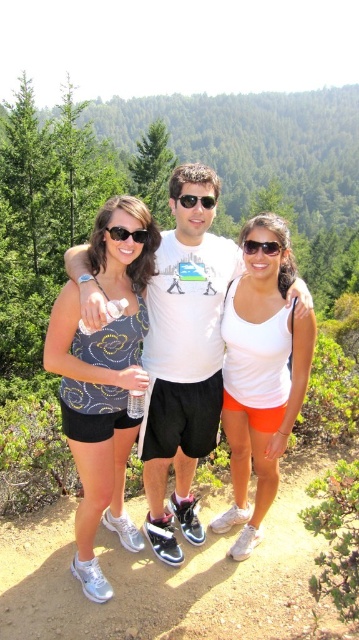
From the picture: You are a photographer trying to capture a group photo of the matte blue tank top at center and the white matte tank top at center. Since you want both tops to appear the same size in the photo, should you move closer to the smaller one or the larger one?

The matte blue tank top at center is smaller than the white matte tank top at center. To make both appear the same size in the photo, you should move closer to the smaller one, which is the matte blue tank top at center.

You are a photographer trying to capture a photo of the two people wearing the matte blue tank top at center and the white matte tank top at center. Which one is positioned to the left of the other?

The matte blue tank top at center is positioned to the left of the white matte tank top at center.

You are a photographer trying to capture the center person in the image. Where should you focus your camera to ensure their white plastic sunglasses at center are clearly visible?

You should focus your camera at point (260, 246) to ensure the white plastic sunglasses at center are clearly visible.